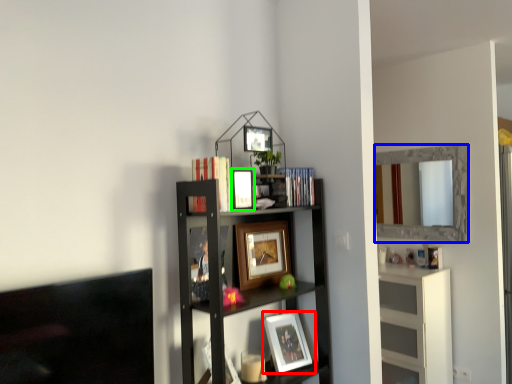
Question: Which is farther away from picture frame (highlighted by a red box)? mirror (highlighted by a blue box) or picture frame (highlighted by a green box)?

Choices:
 (A) mirror
 (B) picture frame

Answer: (A)